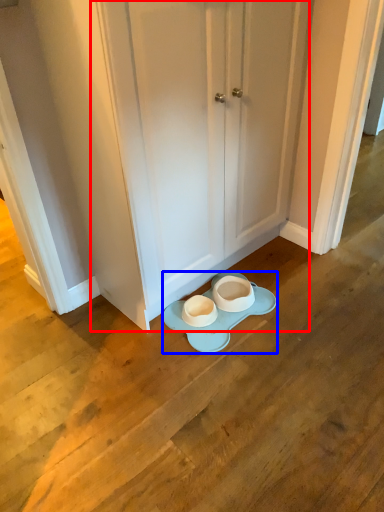
Question: Which object appears farthest to the camera in this image, door (highlighted by a red box) or porcelain (highlighted by a blue box)?

Choices:
 (A) door
 (B) porcelain

Answer: (B)